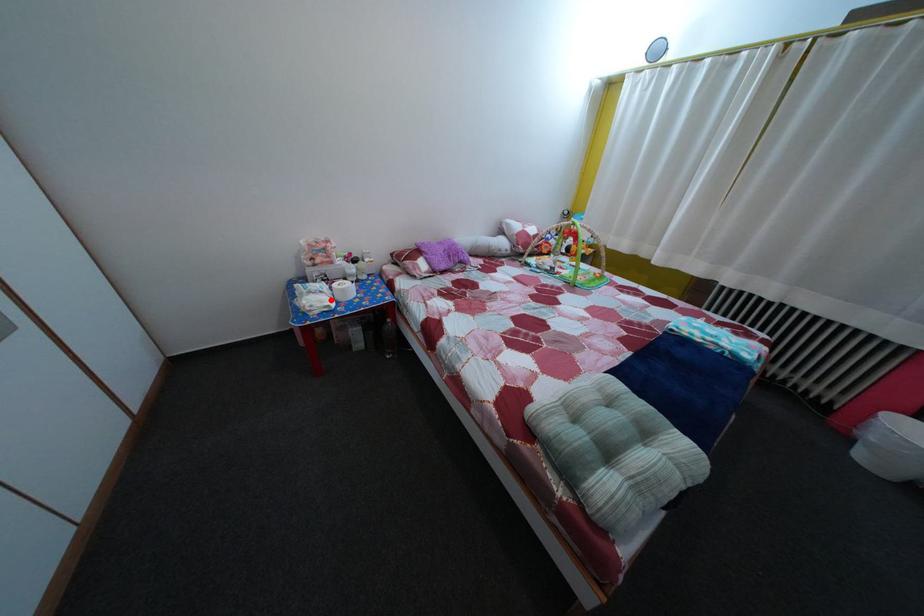
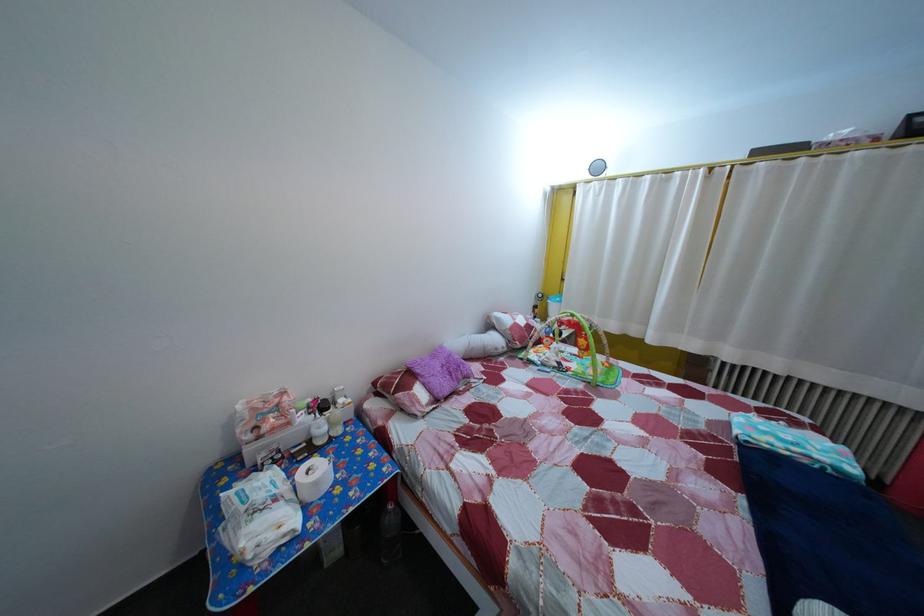
Where in the second image is the point corresponding to the highlighted location from the first image?

(285, 508)